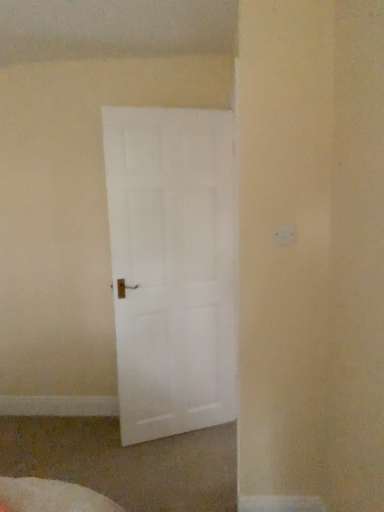
You are a GUI agent. You are given a task and a screenshot of the screen. Output one action in this format:
    pyautogui.click(x=<x>, y=<y>)
    Task: Click on the white matte door at center
    The width and height of the screenshot is (384, 512).
    Given the screenshot: What is the action you would take?
    pyautogui.click(x=172, y=267)

Image resolution: width=384 pixels, height=512 pixels. What do you see at coordinates (172, 267) in the screenshot?
I see `white matte door at center` at bounding box center [172, 267].

What is the approximate height of white matte door at center?

6.52 feet.

In order to click on white matte door at center in this screenshot , I will do `click(172, 267)`.